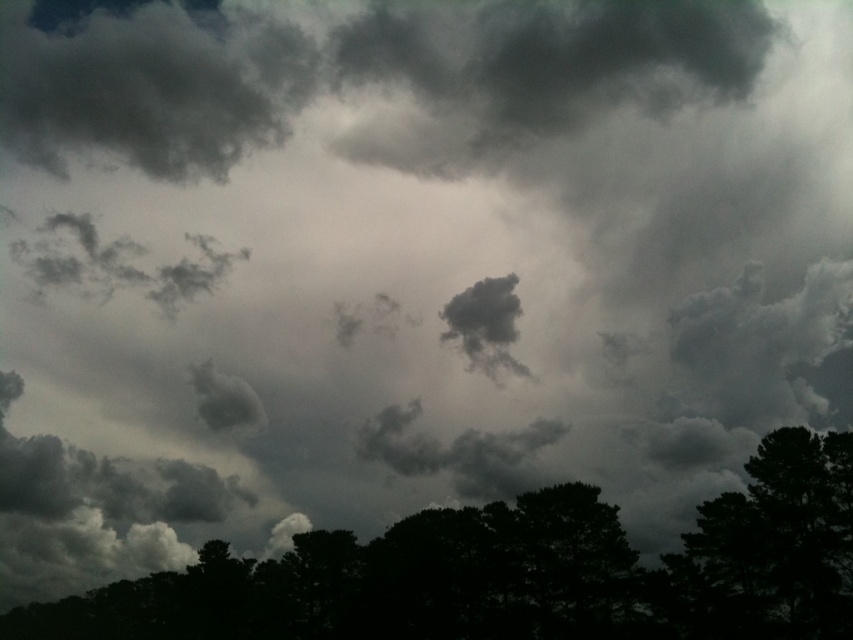
Question: From the image, what is the correct spatial relationship of dark green leafy tree at bottom in relation to dark green leafy tree at lower right?

Choices:
 (A) left
 (B) right

Answer: (A)

Question: Does dark green leafy tree at bottom have a lesser width compared to dark green leafy tree at lower right?

Choices:
 (A) no
 (B) yes

Answer: (A)

Question: Is dark green leafy tree at bottom thinner than dark green leafy tree at lower right?

Choices:
 (A) yes
 (B) no

Answer: (B)

Question: Which point is farther to the camera?

Choices:
 (A) (807, 618)
 (B) (809, 620)

Answer: (A)